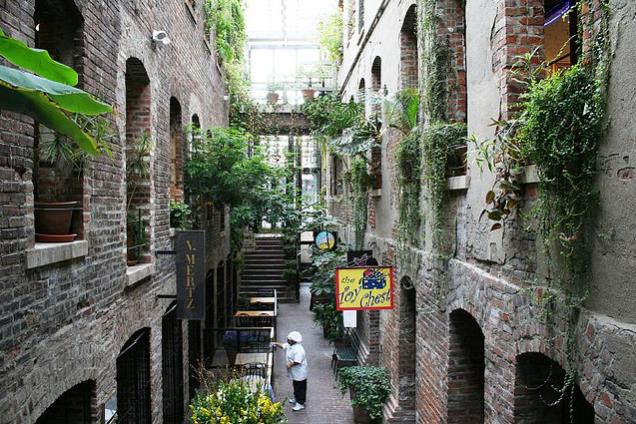
What are the coordinates of `tables` in the screenshot? It's located at (250, 357), (243, 383), (256, 311), (264, 299).